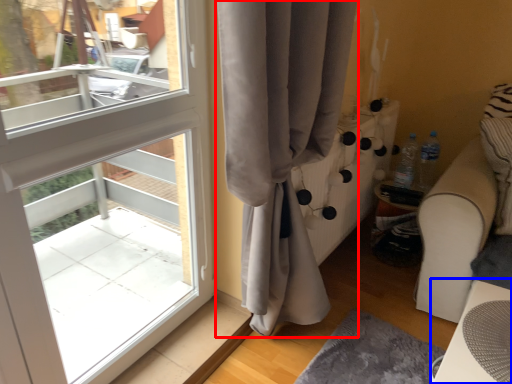
Question: Which object appears farthest to the camera in this image, curtain (highlighted by a red box) or table (highlighted by a blue box)?

Choices:
 (A) curtain
 (B) table

Answer: (B)